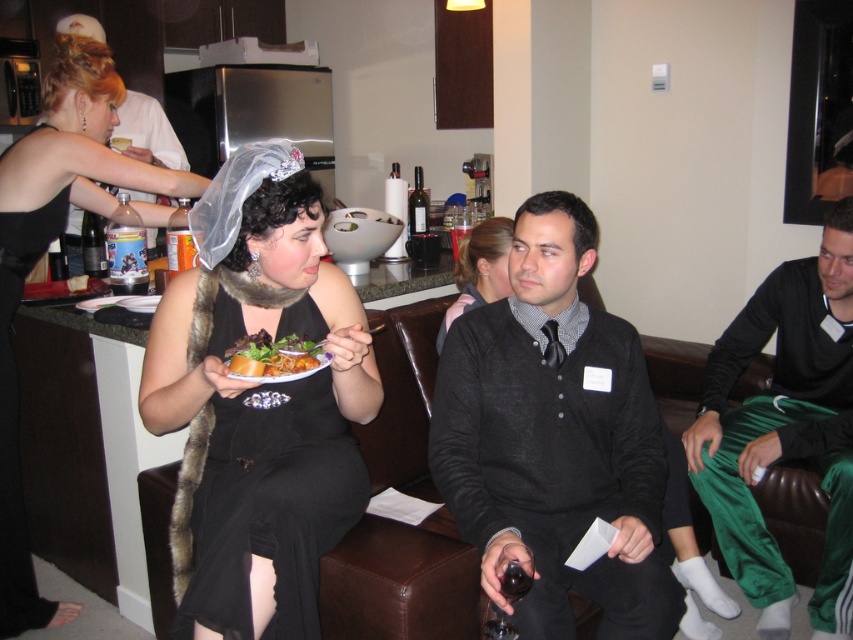
You are a bartender at the party and need to reach the dark glass bottle at center to serve drinks. You are currently standing next to the black satin dress at left. Is the distance between you and the bottle sufficient to move comfortably without bumping into the dress?

The distance between the black satin dress at left and the dark glass bottle at center is 1.45 meters, which should be sufficient for comfortable movement without bumping into the dress.

You are a photographer at the party and want to capture a photo of the black satin dress at left and dark glass bottle at center without any obstruction. Based on their positions, is the dress likely to block the view of the bottle in the photo?

The black satin dress at left is positioned under the dark glass bottle at center, so the bottle is above the dress and would not be obstructed by it in the photo.